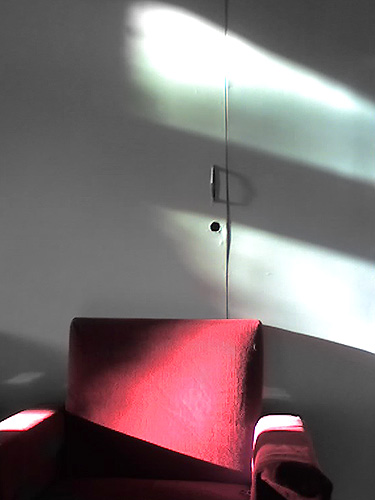
At what (x,y) coordinates should I click in order to perform the action: click on handle. Please return your answer as a coordinate pair (x, y). Looking at the image, I should click on (211, 188).